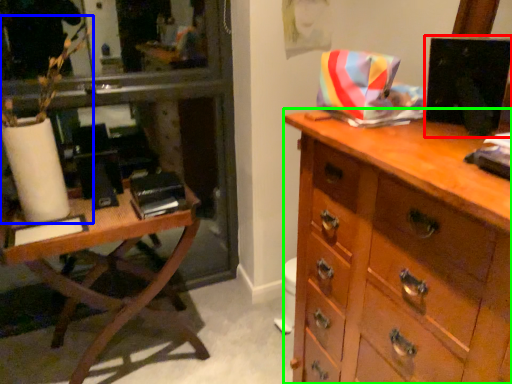
Question: Which object is positioned closest to computer monitor (highlighted by a red box)? Select from plant (highlighted by a blue box) and chest of drawers (highlighted by a green box).

Choices:
 (A) plant
 (B) chest of drawers

Answer: (B)